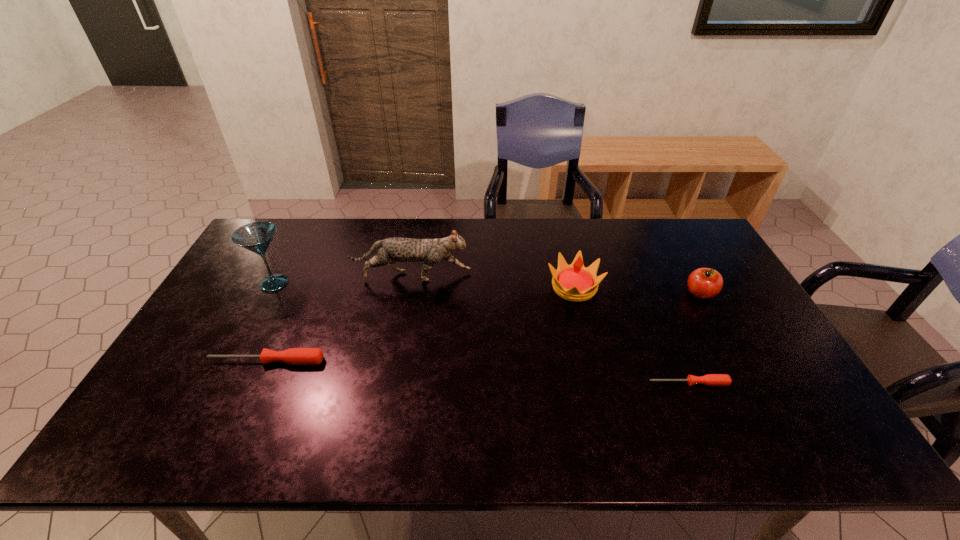
I want to click on the fifth farthest object, so click(296, 356).

You are a GUI agent. You are given a task and a screenshot of the screen. Output one action in this format:
    pyautogui.click(x=<x>, y=<y>)
    Task: Click on the taller screwdriver
    The width and height of the screenshot is (960, 540).
    Given the screenshot: What is the action you would take?
    pyautogui.click(x=296, y=356)

The height and width of the screenshot is (540, 960). Find the location of `the nearer screwdriver`. the nearer screwdriver is located at coordinates (710, 379).

At what (x,y) coordinates should I click in order to perform the action: click on the right screwdriver. Please return your answer as a coordinate pair (x, y). Looking at the image, I should click on (710, 379).

Where is `the third object from right to left`? the third object from right to left is located at coordinates (575, 282).

Where is `the third tallest object`? the third tallest object is located at coordinates (575, 282).

Where is `martini`? martini is located at coordinates (257, 236).

Where is `cat`? This screenshot has width=960, height=540. cat is located at coordinates (391, 250).

At what (x,y) coordinates should I click in order to perform the action: click on the fourth tallest object. Please return your answer as a coordinate pair (x, y). This screenshot has width=960, height=540. Looking at the image, I should click on (704, 283).

I want to click on apple, so click(704, 283).